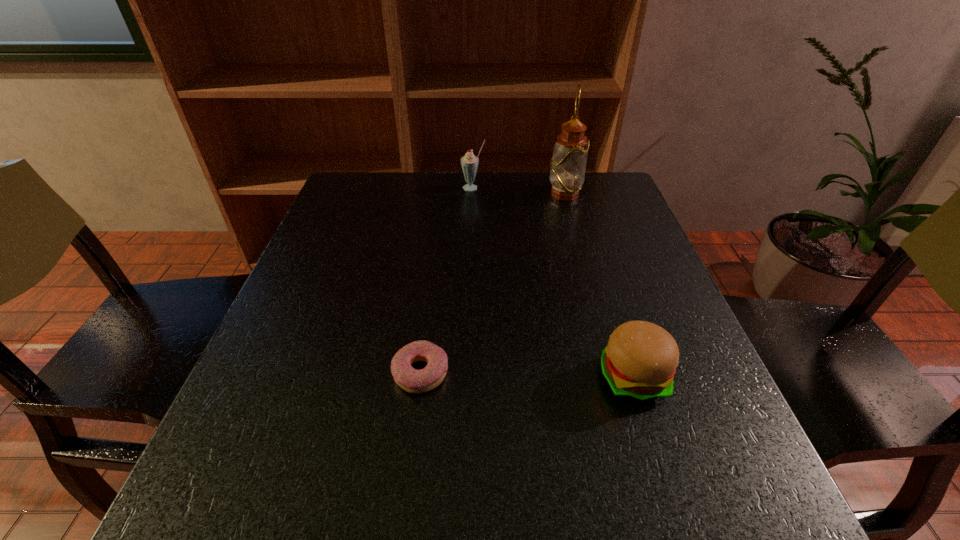
Locate an element on the screen. oil lamp positioned at the far edge is located at coordinates (568, 164).

The width and height of the screenshot is (960, 540). Find the location of `milkshake located at the far edge`. milkshake located at the far edge is located at coordinates (469, 162).

Locate an element on the screen. oil lamp located in the right edge section of the desktop is located at coordinates (568, 164).

In order to click on hamburger that is at the right edge in this screenshot , I will do `click(639, 363)`.

Locate an element on the screen. The height and width of the screenshot is (540, 960). object located in the far right corner section of the desktop is located at coordinates (568, 164).

In the image, there is a desktop. Where is `vacant space at the far edge`? This screenshot has width=960, height=540. vacant space at the far edge is located at coordinates (425, 174).

I want to click on vacant position at the left edge of the desktop, so click(328, 371).

The image size is (960, 540). In order to click on vacant space at the right edge of the desktop in this screenshot , I will do `click(656, 409)`.

In the image, there is a desktop. Find the location of `vacant space at the far left corner`. vacant space at the far left corner is located at coordinates (357, 181).

In the image, there is a desktop. Identify the location of free region at the near left corner. pos(241,534).